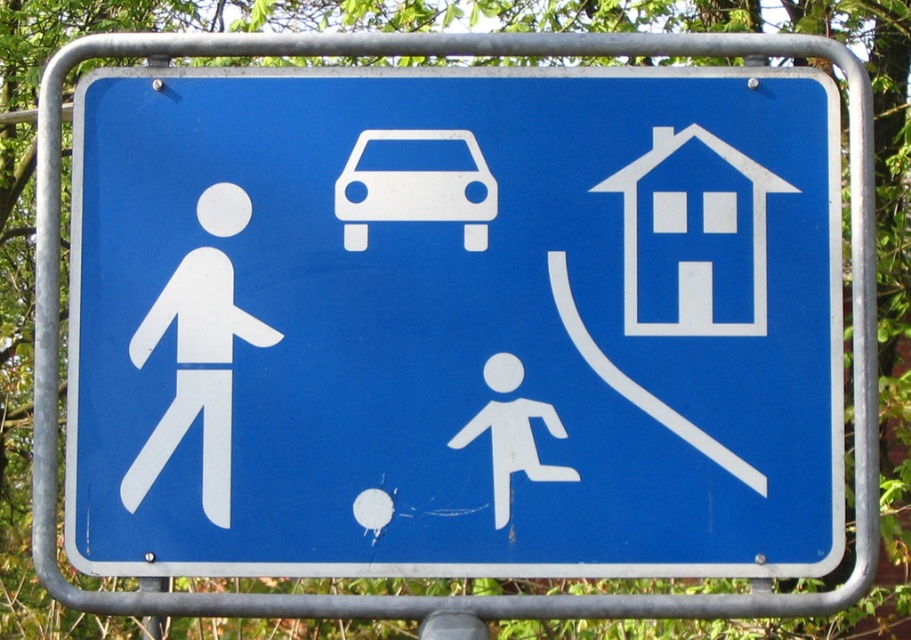
You are a pedestrian approaching a blue plastic sign at center and a white paper figure at left. Which object is closer to the left edge of the image?

The white paper figure at left is closer to the left edge of the image because the blue plastic sign at center is positioned on the right side of it.

You are a delivery driver who needs to know if your 2.5 meters wide truck can fit through the space between the blue plastic sign at center and the white matte car at center. Based on the image, can you determine if the truck will fit?

The blue plastic sign at center is wider than the white matte car at center. Since the truck is 2.5 meters wide, but the exact width of the sign and car are not provided, it is impossible to determine if the truck will fit through the space between them.

You are a delivery driver who needs to park your vehicle near the blue plastic sign at center. Your truck requires a parking space that is at least 4 meters long. Can you park your truck here?

The distance between the blue plastic sign at center and the nearest obstacle is 3.83 meters, which is shorter than the required 4 meters. Therefore, the truck cannot be parked here safely.